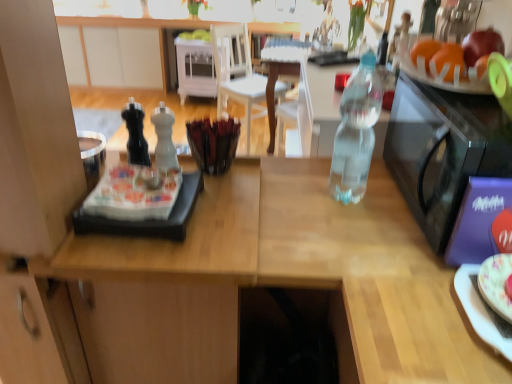
Question: Are white wood chair at center and orange matte at upper right, placed as the second orange when sorted from back to front, beside each other?

Choices:
 (A) no
 (B) yes

Answer: (A)

Question: Does white wood chair at center turn towards orange matte at upper right, placed as the second orange when sorted from back to front?

Choices:
 (A) yes
 (B) no

Answer: (B)

Question: Does white wood chair at center have a smaller size compared to orange matte at upper right, acting as the 1th orange starting from the front?

Choices:
 (A) yes
 (B) no

Answer: (B)

Question: Can you confirm if white wood chair at center is shorter than orange matte at upper right, acting as the 1th orange starting from the front?

Choices:
 (A) no
 (B) yes

Answer: (A)

Question: From the image's perspective, is white wood chair at center under orange matte at upper right, acting as the 1th orange starting from the front?

Choices:
 (A) no
 (B) yes

Answer: (A)

Question: In the image, is white wood cabinet at center, positioned as the first cabinetry in right-to-left order, on the left side or the right side of orange matte at upper right, placed as the second orange when sorted from back to front?

Choices:
 (A) left
 (B) right

Answer: (A)

Question: Is white wood cabinet at center, placed as the 2th cabinetry when sorted from left to right, situated inside orange matte at upper right, acting as the 1th orange starting from the front, or outside?

Choices:
 (A) inside
 (B) outside

Answer: (B)

Question: Does point (180, 91) appear closer or farther from the camera than point (461, 59)?

Choices:
 (A) farther
 (B) closer

Answer: (A)

Question: Considering the positions of white wood cabinet at center, placed as the 2th cabinetry when sorted from left to right, and orange matte at upper right, acting as the 1th orange starting from the front, in the image, is white wood cabinet at center, placed as the 2th cabinetry when sorted from left to right, taller or shorter than orange matte at upper right, acting as the 1th orange starting from the front,?

Choices:
 (A) tall
 (B) short

Answer: (A)

Question: Relative to white matte pepper shaker at center, which is the second bottle in right-to-left order, is white matte cabinet at upper left, marked as the second cabinetry in a right-to-left arrangement, in front or behind?

Choices:
 (A) behind
 (B) front

Answer: (A)

Question: Does point (99, 28) appear closer or farther from the camera than point (158, 114)?

Choices:
 (A) closer
 (B) farther

Answer: (B)

Question: From a real-world perspective, is white matte cabinet at upper left, the first cabinetry positioned from the left, above or below white matte pepper shaker at center, which is the second bottle in right-to-left order?

Choices:
 (A) above
 (B) below

Answer: (B)

Question: Based on their sizes in the image, would you say white matte cabinet at upper left, the first cabinetry positioned from the left, is bigger or smaller than white matte pepper shaker at center, which is the second bottle in right-to-left order?

Choices:
 (A) big
 (B) small

Answer: (A)

Question: Does point (477, 322) appear closer or farther from the camera than point (279, 87)?

Choices:
 (A) farther
 (B) closer

Answer: (B)

Question: Choose the correct answer: Is porcelain floral plate at right inside white wood chair at center or outside it?

Choices:
 (A) outside
 (B) inside

Answer: (A)